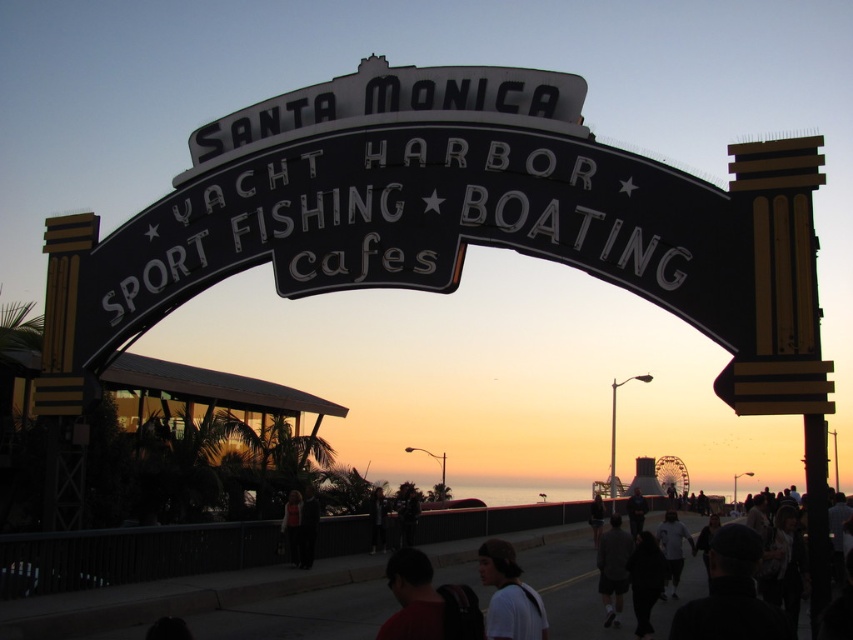
Question: Does dark red shirt at lower center appear under dark blue jacket at center?

Choices:
 (A) no
 (B) yes

Answer: (B)

Question: Can you confirm if dark gray shirt at center is positioned to the left of dark blue jacket at center?

Choices:
 (A) no
 (B) yes

Answer: (B)

Question: Considering the relative positions of dark red shirt at lower center and dark brown leather jacket at center in the image provided, where is dark red shirt at lower center located with respect to dark brown leather jacket at center?

Choices:
 (A) right
 (B) left

Answer: (A)

Question: Which point appears farthest from the camera in this image?

Choices:
 (A) (596, 531)
 (B) (372, 552)
 (C) (635, 504)
 (D) (531, 625)

Answer: (C)

Question: Which is farther from the dark brown leather jacket at center?

Choices:
 (A) dark gray hoodie at center
 (B) white matte shirt at lower center
 (C) dark blue jacket at center

Answer: (C)

Question: Which point is closer to the camera taking this photo?

Choices:
 (A) (618, 532)
 (B) (480, 627)
 (C) (311, 500)
 (D) (527, 604)

Answer: (B)